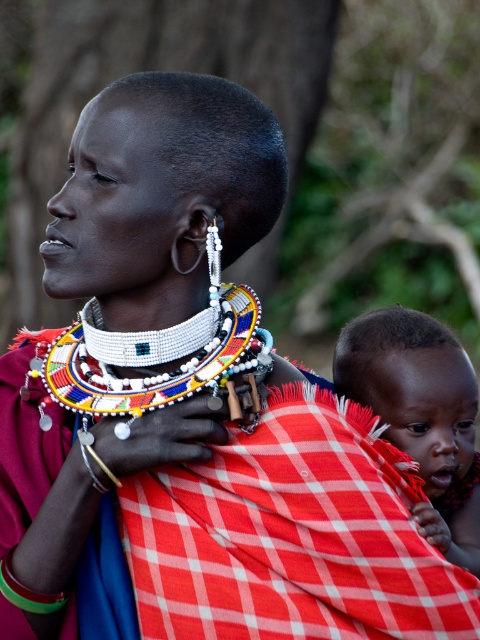
Question: From the image, what is the correct spatial relationship of matte red cloth at center in relation to white beaded necklace at center?

Choices:
 (A) below
 (B) above

Answer: (A)

Question: In this image, where is matte red cloth at center located relative to white beaded necklace at center?

Choices:
 (A) above
 (B) below

Answer: (B)

Question: Which point is farther to the camera?

Choices:
 (A) matte red cloth at center
 (B) white beaded necklace at center

Answer: (A)

Question: Which point is farther to the camera?

Choices:
 (A) white beaded necklace at center
 (B) matte red cloth at center

Answer: (B)

Question: Is matte red cloth at center below white beaded necklace at center?

Choices:
 (A) yes
 (B) no

Answer: (A)